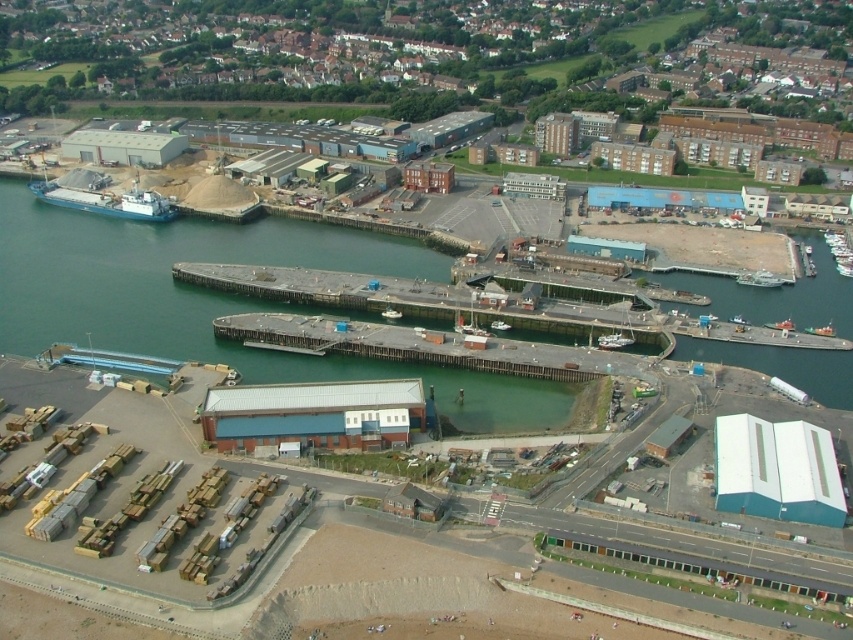
Is metallic gray boat at center wider than white plastic boat at center?

Correct, the width of metallic gray boat at center exceeds that of white plastic boat at center.

This screenshot has height=640, width=853. What do you see at coordinates (613, 340) in the screenshot?
I see `metallic gray boat at center` at bounding box center [613, 340].

Find the location of `metallic gray boat at center`. metallic gray boat at center is located at coordinates (613, 340).

Based on the photo, is blue metallic barge at left shorter than metallic gray ship at center?

No, blue metallic barge at left is not shorter than metallic gray ship at center.

Does blue metallic barge at left have a larger size compared to metallic gray ship at center?

Correct, blue metallic barge at left is larger in size than metallic gray ship at center.

Which is behind, point (42, 188) or point (775, 280)?

The point (42, 188) is more distant.

Where is `blue metallic barge at left`? blue metallic barge at left is located at coordinates 106,202.

Can you confirm if metallic gray ship at center is bigger than white plastic boat at center?

Yes, metallic gray ship at center is bigger than white plastic boat at center.

Between metallic gray ship at center and white plastic boat at center, which one has more height?

metallic gray ship at center is taller.

This screenshot has width=853, height=640. Find the location of `metallic gray ship at center`. metallic gray ship at center is located at coordinates (759, 280).